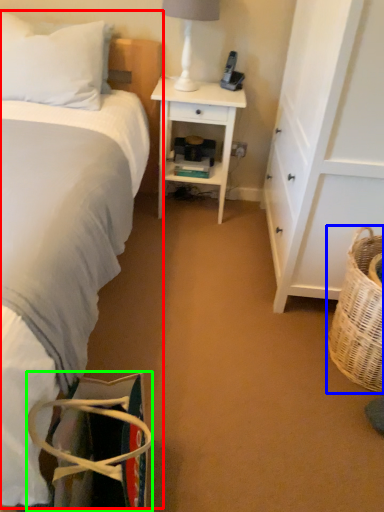
Question: Which is nearer to the bed (highlighted by a red box)? picnic basket (highlighted by a blue box) or handbag (highlighted by a green box).

Choices:
 (A) picnic basket
 (B) handbag

Answer: (B)